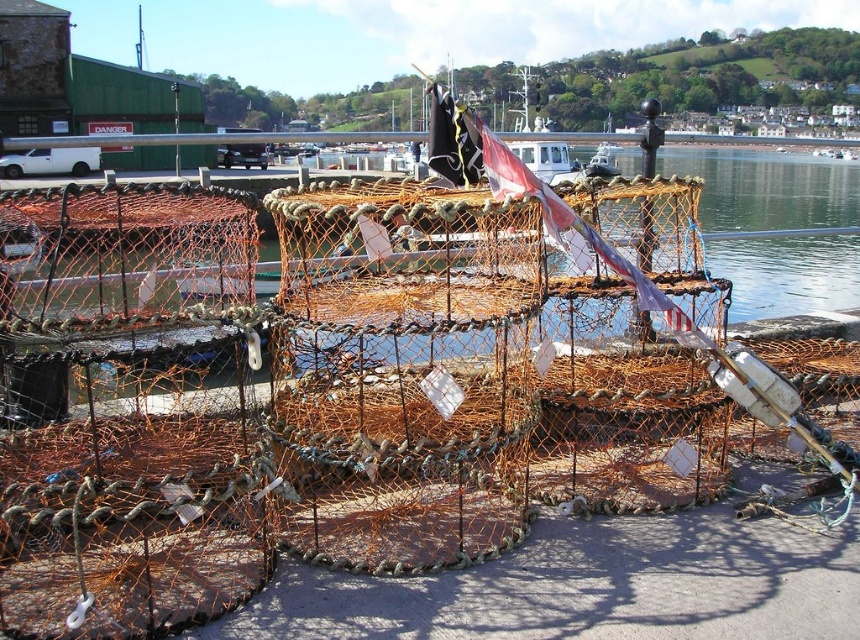
Question: Can you confirm if rustic wire mesh crab pot at center is thinner than white plastic boat at center?

Choices:
 (A) no
 (B) yes

Answer: (B)

Question: Which object appears closest to the camera in this image?

Choices:
 (A) rustic wire mesh crab pot at center
 (B) orange mesh netting at center

Answer: (A)

Question: Which point is closer to the camera?

Choices:
 (A) rustic wire mesh crab pot at center
 (B) white plastic boat at center
 (C) orange mesh netting at center

Answer: (A)

Question: Does rustic wire mesh crab pot at center appear on the left side of white plastic boat at center?

Choices:
 (A) no
 (B) yes

Answer: (B)

Question: Can you confirm if rustic wire mesh crab pot at center is positioned to the left of orange mesh netting at center?

Choices:
 (A) yes
 (B) no

Answer: (A)

Question: Which object is farther from the camera taking this photo?

Choices:
 (A) orange mesh netting at center
 (B) rustic wire mesh crab pot at center
 (C) white plastic boat at center

Answer: (C)